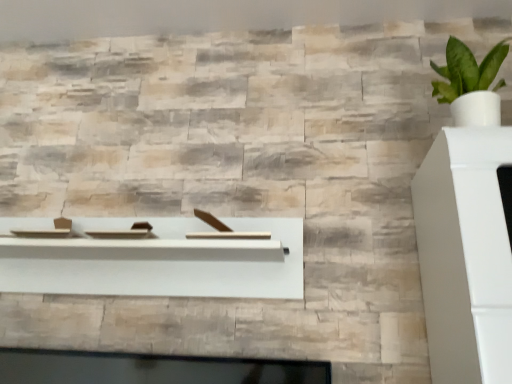
Question: Considering the relative sizes of green leafy plant in white pot at upper right and natural stone wall at upper center in the image provided, is green leafy plant in white pot at upper right thinner than natural stone wall at upper center?

Choices:
 (A) yes
 (B) no

Answer: (A)

Question: Is green leafy plant in white pot at upper right in contact with natural stone wall at upper center?

Choices:
 (A) no
 (B) yes

Answer: (A)

Question: Could you tell me if green leafy plant in white pot at upper right is facing natural stone wall at upper center?

Choices:
 (A) yes
 (B) no

Answer: (B)

Question: Is green leafy plant in white pot at upper right outside of natural stone wall at upper center?

Choices:
 (A) no
 (B) yes

Answer: (B)

Question: Does green leafy plant in white pot at upper right have a lesser height compared to natural stone wall at upper center?

Choices:
 (A) yes
 (B) no

Answer: (B)

Question: From a real-world perspective, relative to green leafy plant in white pot at upper right, is natural stone wall at upper center vertically above or below?

Choices:
 (A) above
 (B) below

Answer: (A)

Question: Considering the relative positions of natural stone wall at upper center and green leafy plant in white pot at upper right in the image provided, is natural stone wall at upper center to the left or to the right of green leafy plant in white pot at upper right?

Choices:
 (A) right
 (B) left

Answer: (B)

Question: Is natural stone wall at upper center bigger or smaller than green leafy plant in white pot at upper right?

Choices:
 (A) big
 (B) small

Answer: (A)

Question: Is natural stone wall at upper center inside or outside of green leafy plant in white pot at upper right?

Choices:
 (A) outside
 (B) inside

Answer: (A)

Question: Is green leafy plant in white pot at upper right bigger or smaller than white matte wood shelf at center?

Choices:
 (A) small
 (B) big

Answer: (A)

Question: Is point (479, 102) positioned closer to the camera than point (78, 218)?

Choices:
 (A) closer
 (B) farther

Answer: (A)

Question: From a real-world perspective, is green leafy plant in white pot at upper right physically located above or below white matte wood shelf at center?

Choices:
 (A) below
 (B) above

Answer: (B)

Question: Considering the positions of green leafy plant in white pot at upper right and white matte wood shelf at center in the image, is green leafy plant in white pot at upper right taller or shorter than white matte wood shelf at center?

Choices:
 (A) tall
 (B) short

Answer: (A)

Question: Considering the positions of point (472, 99) and point (437, 1), is point (472, 99) closer or farther from the camera than point (437, 1)?

Choices:
 (A) farther
 (B) closer

Answer: (B)

Question: Is green leafy plant in white pot at upper right in front of or behind natural stone wall at upper center in the image?

Choices:
 (A) front
 (B) behind

Answer: (A)